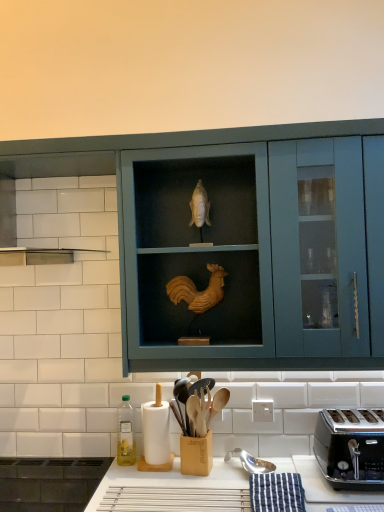
Question: Is teal matte cabinet at center further to camera compared to white matte paper towel at lower left?

Choices:
 (A) no
 (B) yes

Answer: (A)

Question: Is teal matte cabinet at center facing away from white matte paper towel at lower left?

Choices:
 (A) no
 (B) yes

Answer: (A)

Question: From the image's perspective, would you say teal matte cabinet at center is positioned over white matte paper towel at lower left?

Choices:
 (A) yes
 (B) no

Answer: (A)

Question: Can you see teal matte cabinet at center touching white matte paper towel at lower left?

Choices:
 (A) yes
 (B) no

Answer: (B)

Question: Is teal matte cabinet at center closer to camera compared to white matte paper towel at lower left?

Choices:
 (A) no
 (B) yes

Answer: (B)

Question: From a real-world perspective, is teal matte cabinet at center under white matte paper towel at lower left?

Choices:
 (A) no
 (B) yes

Answer: (A)

Question: Are teal matte cabinet at center and green glass bottle at lower left beside each other?

Choices:
 (A) no
 (B) yes

Answer: (A)

Question: Can you confirm if teal matte cabinet at center is thinner than green glass bottle at lower left?

Choices:
 (A) yes
 (B) no

Answer: (B)

Question: From the image's perspective, does teal matte cabinet at center appear higher than green glass bottle at lower left?

Choices:
 (A) yes
 (B) no

Answer: (A)

Question: From a real-world perspective, does teal matte cabinet at center stand above green glass bottle at lower left?

Choices:
 (A) no
 (B) yes

Answer: (B)

Question: Is teal matte cabinet at center to the left of green glass bottle at lower left from the viewer's perspective?

Choices:
 (A) no
 (B) yes

Answer: (A)

Question: Is teal matte cabinet at center closer to camera compared to green glass bottle at lower left?

Choices:
 (A) no
 (B) yes

Answer: (B)

Question: Does green glass bottle at lower left have a larger size compared to black metallic toaster at lower right?

Choices:
 (A) no
 (B) yes

Answer: (A)